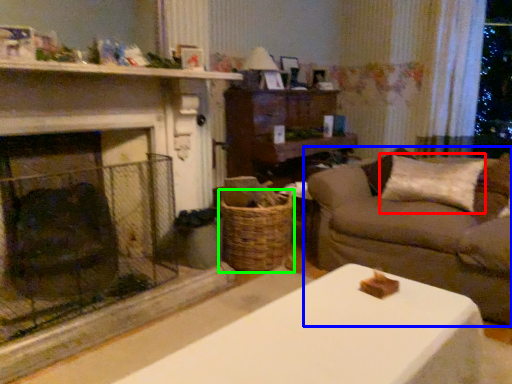
Question: Which object is the closest to the pillow (highlighted by a red box)? Choose among these: studio couch (highlighted by a blue box) or basket (highlighted by a green box).

Choices:
 (A) studio couch
 (B) basket

Answer: (A)